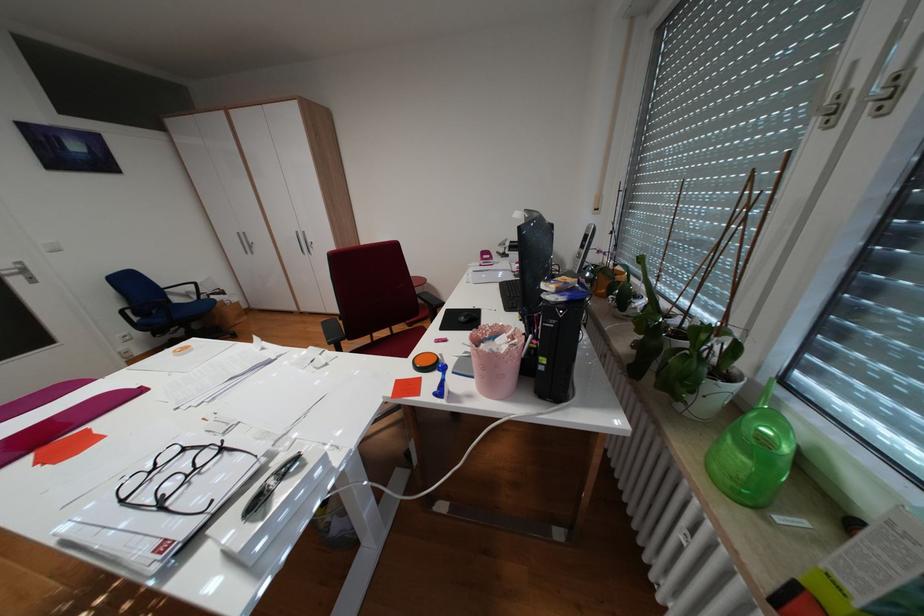
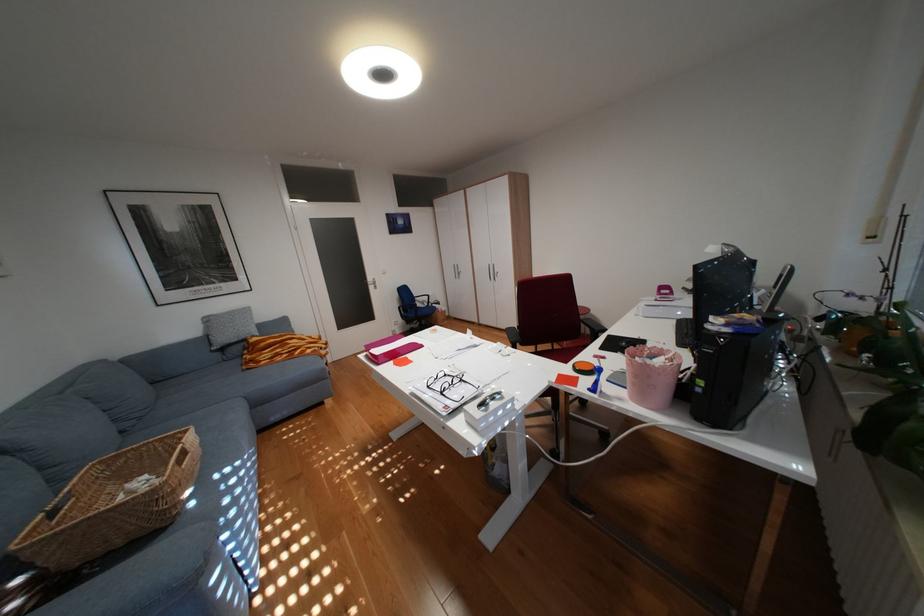
Find the pixel in the second image that matches pixel 482 395 in the first image.

(633, 399)